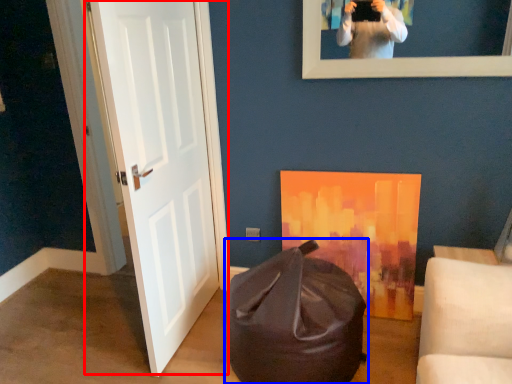
Question: Which object appears farthest to the camera in this image, door (highlighted by a red box) or bean bag chair (highlighted by a blue box)?

Choices:
 (A) door
 (B) bean bag chair

Answer: (B)